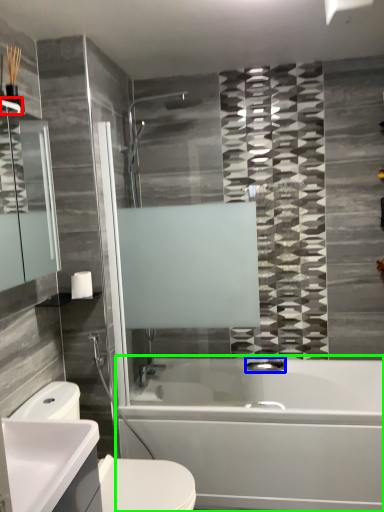
Question: Which object is the farthest from towel bar (highlighted by a red box)? Choose among these: plumbing fixture (highlighted by a blue box) or bathtub (highlighted by a green box).

Choices:
 (A) plumbing fixture
 (B) bathtub

Answer: (A)